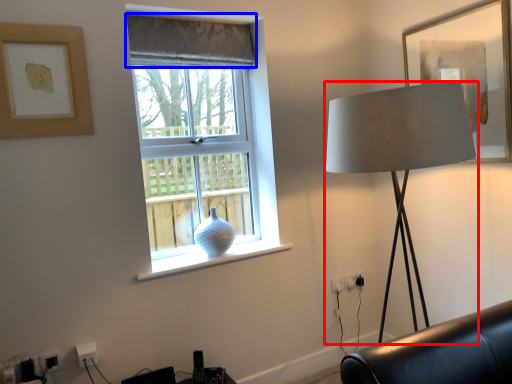
Question: Which point is further to the camera, lamp (highlighted by a red box) or curtain (highlighted by a blue box)?

Choices:
 (A) lamp
 (B) curtain

Answer: (B)